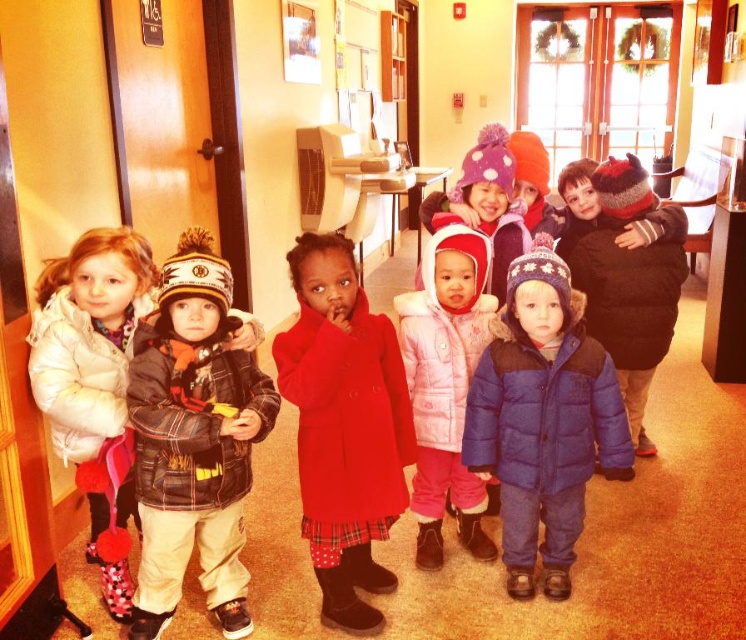
Does velvet red coat at center have a smaller size compared to purple fuzzy hat at center?

No.

Can you confirm if velvet red coat at center is wider than purple fuzzy hat at center?

In fact, velvet red coat at center might be narrower than purple fuzzy hat at center.

Does point (404, 486) lie behind point (495, 129)?

No, (404, 486) is in front of (495, 129).

The image size is (746, 640). I want to click on velvet red coat at center, so click(x=344, y=426).

Which of these two, blue puffy coat at center or pink fleece coat at center, stands shorter?

blue puffy coat at center

Does blue puffy coat at center have a larger size compared to pink fleece coat at center?

Incorrect, blue puffy coat at center is not larger than pink fleece coat at center.

Between point (562, 346) and point (430, 289), which one is positioned in front?

Point (562, 346) is in front.

Identify the location of blue puffy coat at center. (542, 420).

Can you confirm if matte black jacket at center is thinner than purple fuzzy hat at center?

No, matte black jacket at center is not thinner than purple fuzzy hat at center.

Is point (203, 518) farther from viewer compared to point (492, 128)?

That is False.

Between point (198, 417) and point (486, 176), which one is positioned behind?

The point (486, 176) is more distant.

Where is `matte black jacket at center`? The image size is (746, 640). matte black jacket at center is located at coordinates (194, 440).